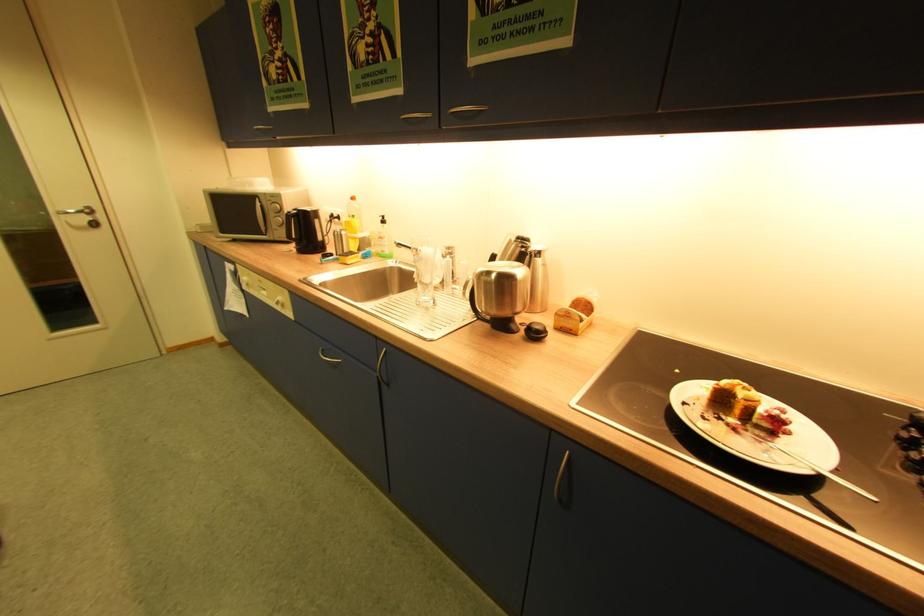
Identify the location of black kettle handle. (469, 293).